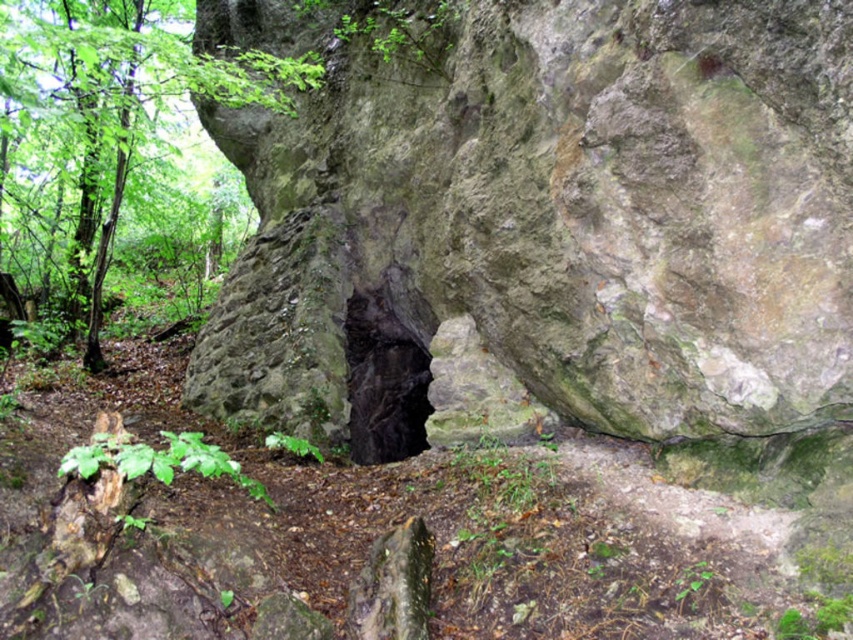
Can you confirm if green mossy rock at center is positioned below green leafy tree at upper left?

Correct, green mossy rock at center is located below green leafy tree at upper left.

Who is lower down, green mossy rock at center or green leafy tree at upper left?

green mossy rock at center

Is point (671, 257) farther from viewer compared to point (26, 212)?

No, (671, 257) is closer to viewer.

Identify the location of green mossy rock at center. This screenshot has width=853, height=640. (543, 218).

Does green mossy rock at center have a larger size compared to black stone hole at center?

Actually, green mossy rock at center might be smaller than black stone hole at center.

Is green mossy rock at center below black stone hole at center?

A: No.

Does point (282, 29) come closer to viewer compared to point (387, 294)?

No, it is behind (387, 294).

The height and width of the screenshot is (640, 853). What are the coordinates of `green mossy rock at center` in the screenshot? It's located at (543, 218).

The image size is (853, 640). Identify the location of green leafy tree at upper left. (111, 163).

Does green leafy tree at upper left have a smaller size compared to black stone hole at center?

Incorrect, green leafy tree at upper left is not smaller in size than black stone hole at center.

What do you see at coordinates (111, 163) in the screenshot? The image size is (853, 640). I see `green leafy tree at upper left` at bounding box center [111, 163].

Where is `green leafy tree at upper left`? Image resolution: width=853 pixels, height=640 pixels. green leafy tree at upper left is located at coordinates (111, 163).